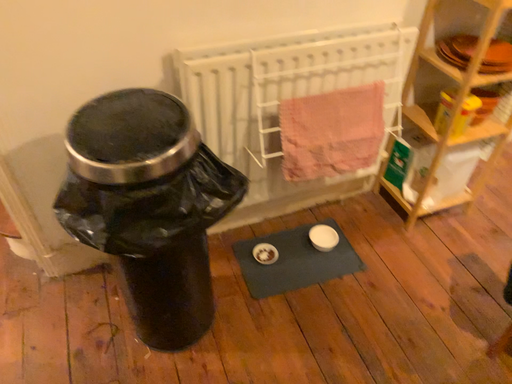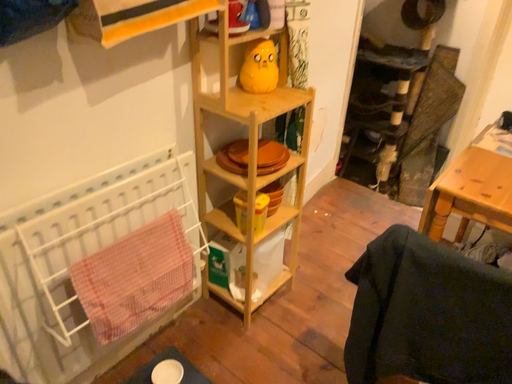
Question: Which way did the camera rotate in the video?

Choices:
 (A) rotated left
 (B) rotated right

Answer: (B)